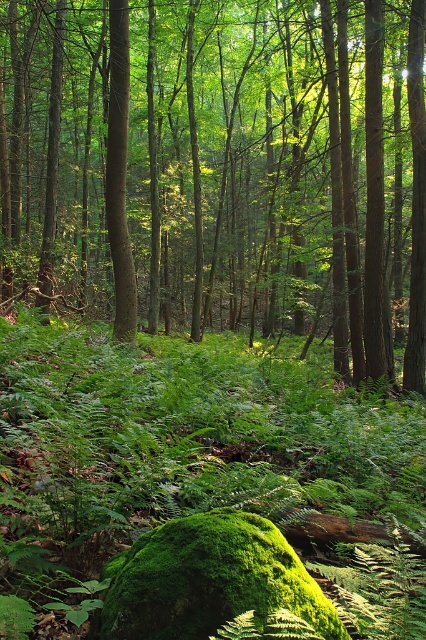
In the scene shown: You are a hiker who wants to take a photo of both the green leafy tree at center and the green matte tree trunk at center. Since you want them both in the frame, which one should you position closer to the camera to ensure both are visible?

To ensure both the green leafy tree at center and the green matte tree trunk at center are visible in the photo, you should position the green leafy tree at center closer to the camera. Since it is on the right side of the green matte tree trunk at center, moving closer to it will keep both within the frame without one blocking the other.

You are a bird flying over the forest scene. You want to land on the highest point between the green leafy tree at center and the green matte tree trunk at center. Which one should you choose?

The green leafy tree at center is above the green matte tree trunk at center, so you should choose the green leafy tree at center to land on as it is the highest point.